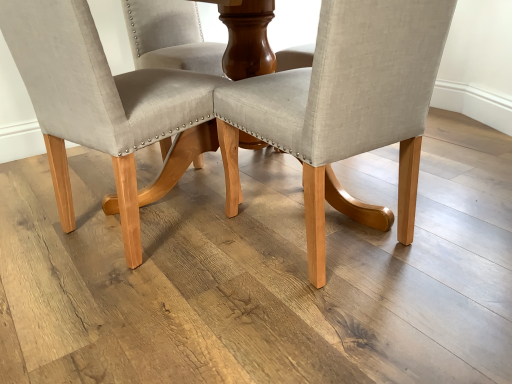
Where is `vacant region to the left of beige fabric chair at center, which ranks as the second chair in left-to-right order`? vacant region to the left of beige fabric chair at center, which ranks as the second chair in left-to-right order is located at coordinates (179, 280).